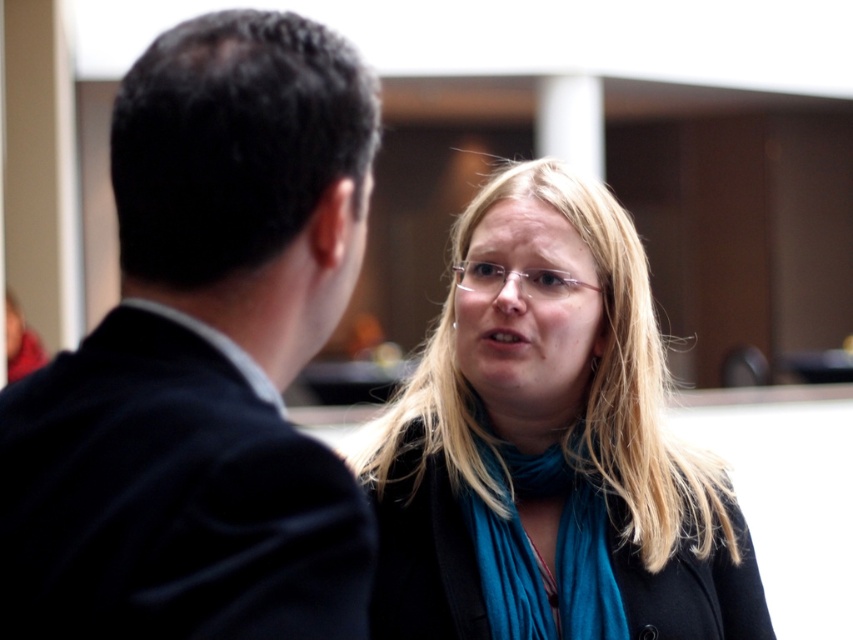
Question: Which point is farther to the camera?

Choices:
 (A) (403, 438)
 (B) (460, 550)
 (C) (207, 504)

Answer: (A)

Question: In this image, where is black suit at left located relative to matte black coat at center?

Choices:
 (A) right
 (B) left

Answer: (B)

Question: Can you confirm if blue fabric scarf at center is positioned to the left of teal soft fabric scarf at center?

Choices:
 (A) yes
 (B) no

Answer: (A)

Question: From the image, what is the correct spatial relationship of black suit at left in relation to teal soft fabric scarf at center?

Choices:
 (A) above
 (B) below

Answer: (A)

Question: Considering the real-world distances, which object is closest to the blue fabric scarf at center?

Choices:
 (A) matte black coat at center
 (B) black suit at left

Answer: (A)

Question: Among these points, which one is farthest from the camera?

Choices:
 (A) (527, 497)
 (B) (448, 564)

Answer: (A)